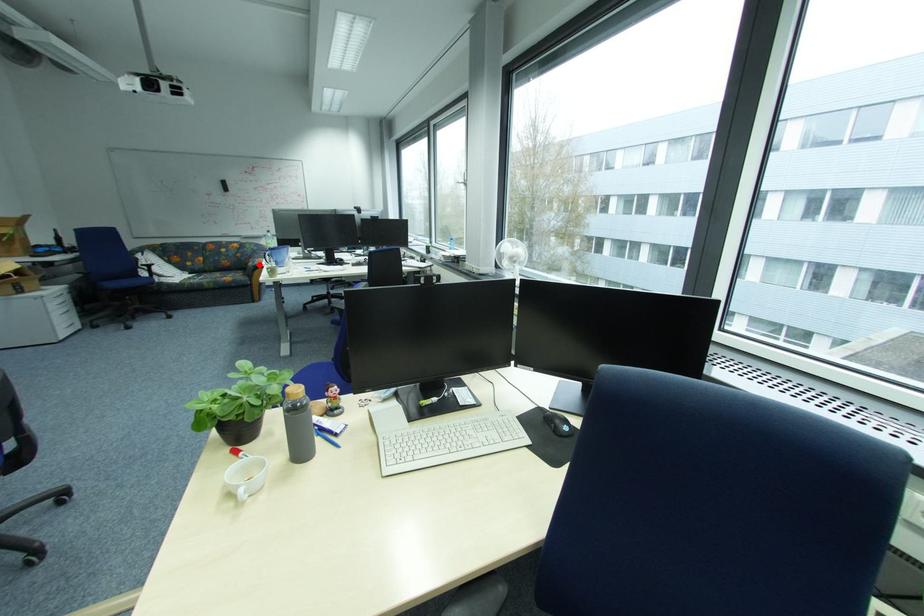
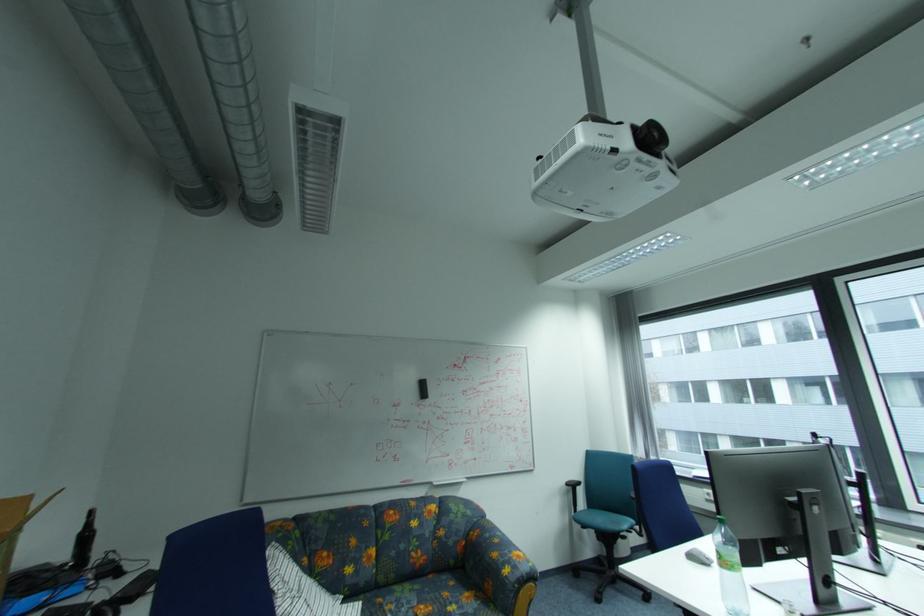
Question: I am providing you with two images of the same scene from different viewpoints. A red point is shown in image1. For the corresponding object point in image2, is it positioned nearer or farther from the camera?

Choices:
 (A) Nearer
 (B) Farther

Answer: (A)